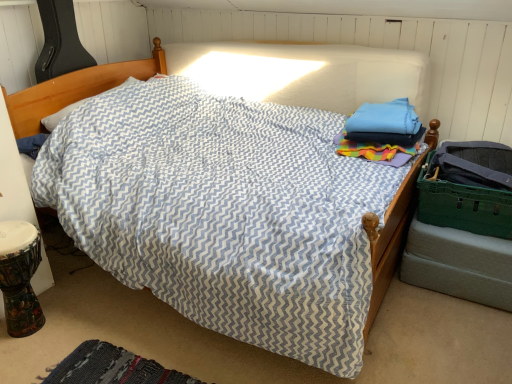
Question: Is green plastic laundry basket at right taller or shorter than woven fabric mat at lower left?

Choices:
 (A) short
 (B) tall

Answer: (B)

Question: From a real-world perspective, is green plastic laundry basket at right positioned above or below woven fabric mat at lower left?

Choices:
 (A) below
 (B) above

Answer: (B)

Question: In the image, is green plastic laundry basket at right positioned in front of or behind woven fabric mat at lower left?

Choices:
 (A) front
 (B) behind

Answer: (B)

Question: Considering the positions of point (101, 374) and point (431, 218), is point (101, 374) closer or farther from the camera than point (431, 218)?

Choices:
 (A) farther
 (B) closer

Answer: (B)

Question: From the image's perspective, is woven fabric mat at lower left located above or below green plastic laundry basket at right?

Choices:
 (A) below
 (B) above

Answer: (A)

Question: Looking at the image, does woven fabric mat at lower left seem bigger or smaller compared to green plastic laundry basket at right?

Choices:
 (A) small
 (B) big

Answer: (A)

Question: In terms of width, does woven fabric mat at lower left look wider or thinner when compared to green plastic laundry basket at right?

Choices:
 (A) wide
 (B) thin

Answer: (A)